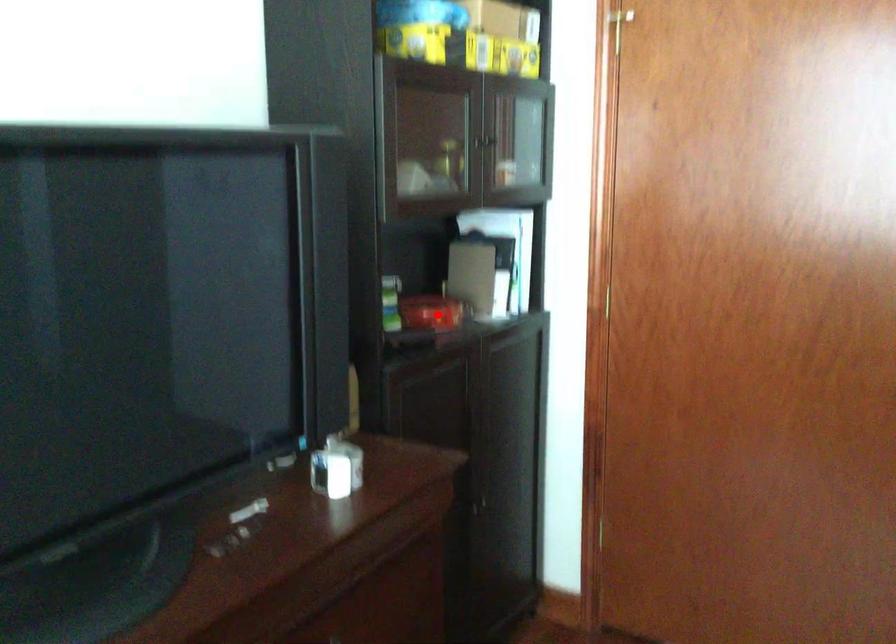
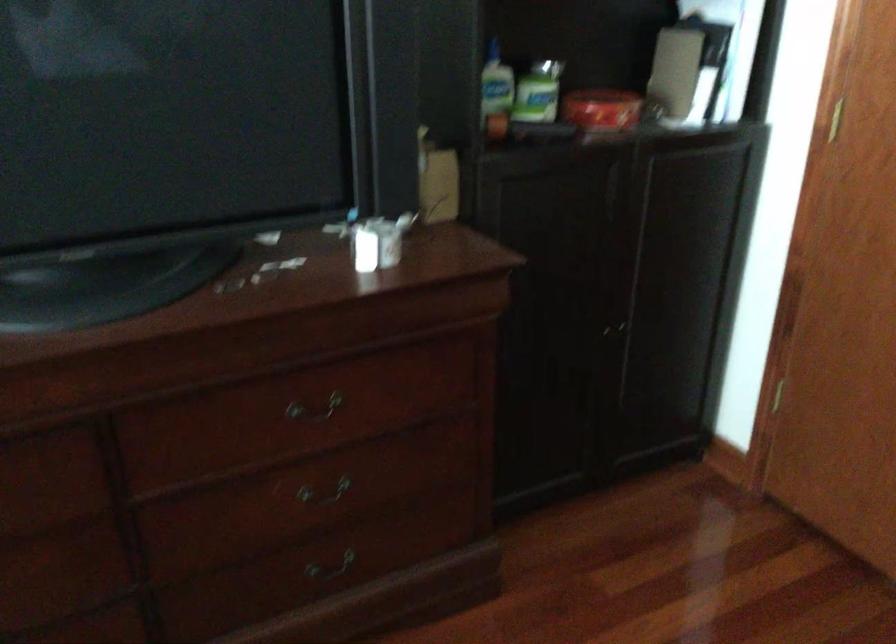
Question: A red point is marked in image1. In image2, is the corresponding 3D point closer to the camera or farther? Reply with the corresponding letter.

Choices:
 (A) The corresponding 3D point is closer.
 (B) The corresponding 3D point is farther.

Answer: (A)